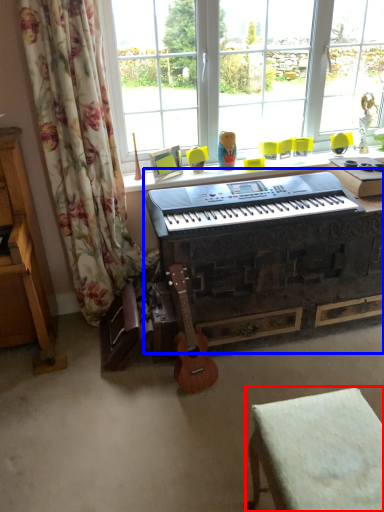
Question: Which object appears farthest to the camera in this image, furniture (highlighted by a red box) or piano (highlighted by a blue box)?

Choices:
 (A) furniture
 (B) piano

Answer: (B)